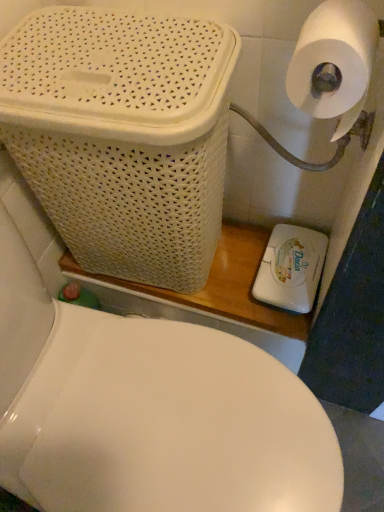
Question: Is white glossy toilet at center to the left of white wicker basket at upper left from the viewer's perspective?

Choices:
 (A) no
 (B) yes

Answer: (A)

Question: Does white glossy toilet at center appear on the right side of white wicker basket at upper left?

Choices:
 (A) no
 (B) yes

Answer: (B)

Question: Is the depth of white glossy toilet at center greater than that of white wicker basket at upper left?

Choices:
 (A) no
 (B) yes

Answer: (A)

Question: Is white wicker basket at upper left at the back of white glossy toilet at center?

Choices:
 (A) yes
 (B) no

Answer: (B)

Question: Is white glossy toilet at center smaller than white wicker basket at upper left?

Choices:
 (A) no
 (B) yes

Answer: (A)

Question: Is white glossy toilet at center bigger than white wicker basket at upper left?

Choices:
 (A) no
 (B) yes

Answer: (B)

Question: Does white wicker basket at upper left have a lesser height compared to white plastic soap dispenser at lower right?

Choices:
 (A) yes
 (B) no

Answer: (B)

Question: Is white wicker basket at upper left wider than white plastic soap dispenser at lower right?

Choices:
 (A) no
 (B) yes

Answer: (B)

Question: Is white wicker basket at upper left at the right side of white plastic soap dispenser at lower right?

Choices:
 (A) no
 (B) yes

Answer: (A)

Question: Is white wicker basket at upper left positioned with its back to white plastic soap dispenser at lower right?

Choices:
 (A) yes
 (B) no

Answer: (B)

Question: Is white wicker basket at upper left not inside white plastic soap dispenser at lower right?

Choices:
 (A) yes
 (B) no

Answer: (A)

Question: From the image's perspective, is white wicker basket at upper left above white plastic soap dispenser at lower right?

Choices:
 (A) yes
 (B) no

Answer: (A)

Question: Is the depth of white matte toilet paper at upper right less than that of white plastic soap dispenser at lower right?

Choices:
 (A) yes
 (B) no

Answer: (A)